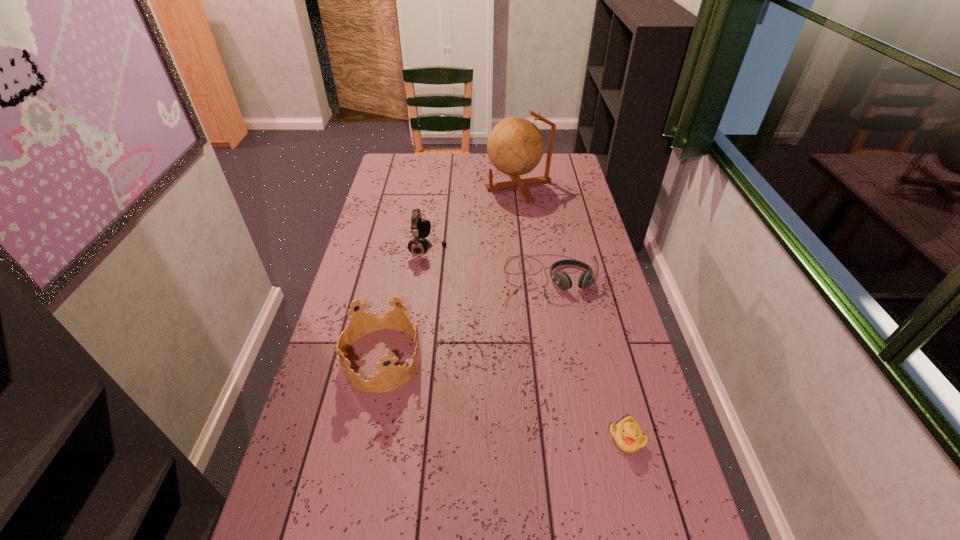
Where is `vacant space located on the surface of the farthest object`? vacant space located on the surface of the farthest object is located at coordinates (451, 185).

You are a GUI agent. You are given a task and a screenshot of the screen. Output one action in this format:
    pyautogui.click(x=<x>, y=<y>)
    Task: Click on the vacant space located 0.260m with the microphone on the side of the taller headset
    This screenshot has width=960, height=540.
    Given the screenshot: What is the action you would take?
    pyautogui.click(x=517, y=248)

Image resolution: width=960 pixels, height=540 pixels. In order to click on vacant region located on the front-facing side of the second nearest object in this screenshot , I will do `click(460, 359)`.

In order to click on vacant region located 0.150m on the outer surface of the shorter headset in this screenshot , I will do `click(558, 346)`.

The height and width of the screenshot is (540, 960). In order to click on free location located 0.130m on the front-facing side of the nearest object in this screenshot , I will do `click(645, 512)`.

The height and width of the screenshot is (540, 960). Find the location of `object present at the far edge`. object present at the far edge is located at coordinates (515, 146).

I want to click on object present at the left edge, so point(391,377).

The image size is (960, 540). In order to click on globe at the right edge in this screenshot , I will do `click(515, 146)`.

At what (x,y) coordinates should I click in order to perform the action: click on headset that is at the right edge. Please return your answer as a coordinate pair (x, y). Image resolution: width=960 pixels, height=540 pixels. Looking at the image, I should click on (562, 279).

This screenshot has width=960, height=540. Identify the location of duckling that is at the right edge. (627, 434).